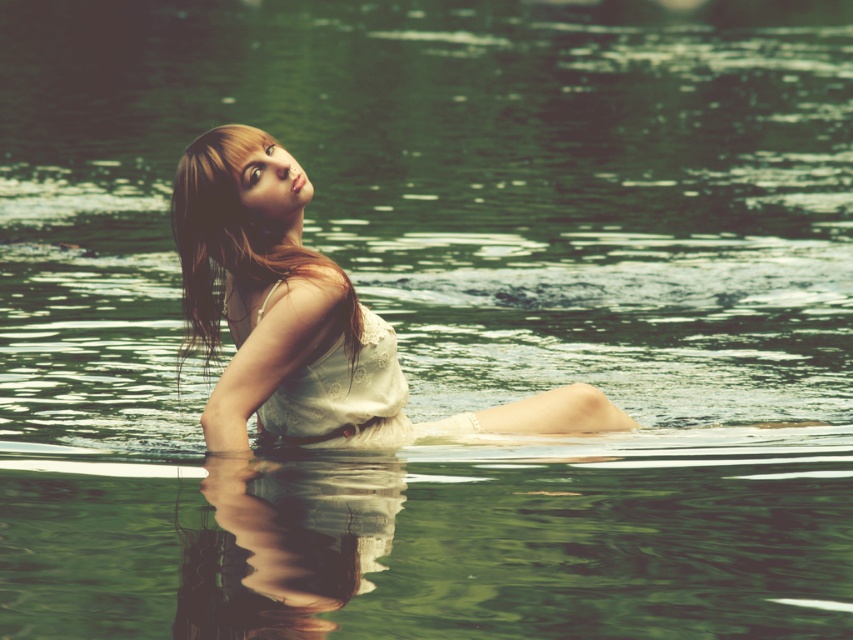
Question: Which is farther from the white lace dress at center?

Choices:
 (A) brown shiny hair at upper left
 (B) matte white dress at center

Answer: (A)

Question: Does matte white dress at center appear on the right side of white lace dress at center?

Choices:
 (A) no
 (B) yes

Answer: (B)

Question: Can you confirm if matte white dress at center is smaller than white lace dress at center?

Choices:
 (A) no
 (B) yes

Answer: (A)

Question: Is matte white dress at center above brown shiny hair at upper left?

Choices:
 (A) yes
 (B) no

Answer: (B)

Question: Which object is positioned closest to the matte white dress at center?

Choices:
 (A) brown shiny hair at upper left
 (B) white lace dress at center

Answer: (B)

Question: Which is nearer to the matte white dress at center?

Choices:
 (A) brown shiny hair at upper left
 (B) white lace dress at center

Answer: (B)